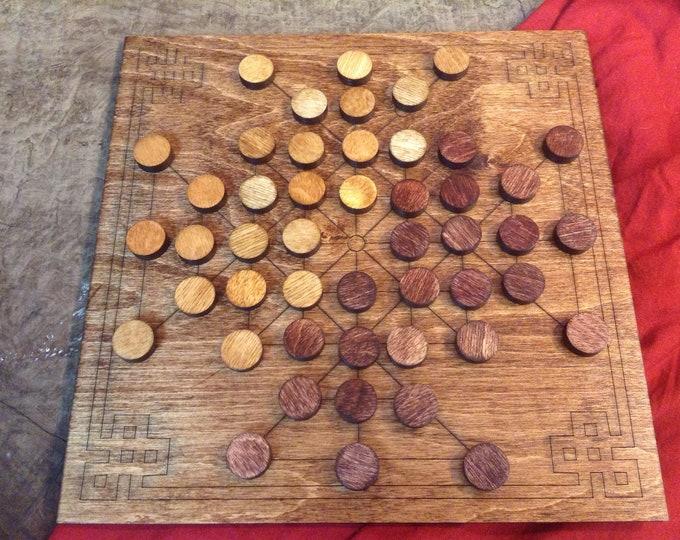
You are a GUI agent. You are given a task and a screenshot of the screen. Output one action in this format:
    pyautogui.click(x=<x>, y=<y>)
    Task: Click on the blanket
    The image size is (680, 540).
    Given the screenshot: What is the action you would take?
    pyautogui.click(x=647, y=120)